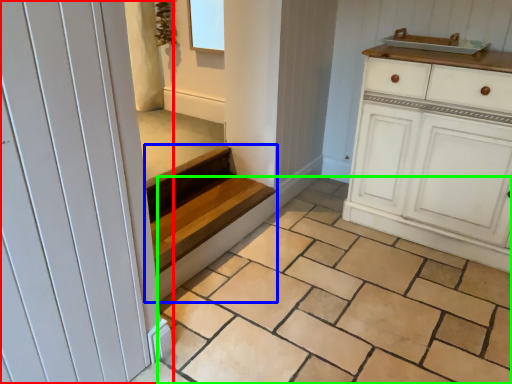
Question: Estimate the real-world distances between objects in this image. Which object is closer to door (highlighted by a red box), stairs (highlighted by a blue box) or tile (highlighted by a green box)?

Choices:
 (A) stairs
 (B) tile

Answer: (B)